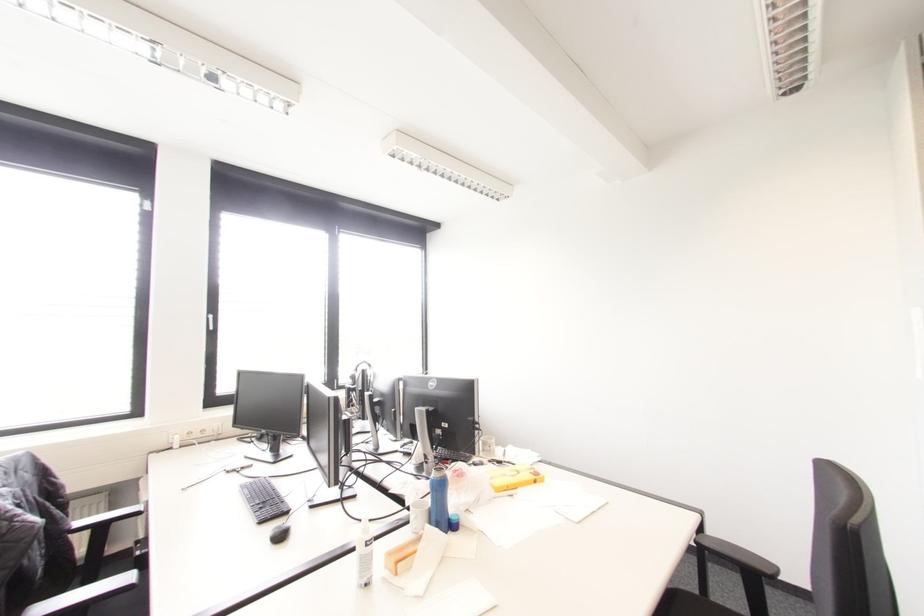
What do you see at coordinates (418, 522) in the screenshot? The height and width of the screenshot is (616, 924). I see `the white mug handle` at bounding box center [418, 522].